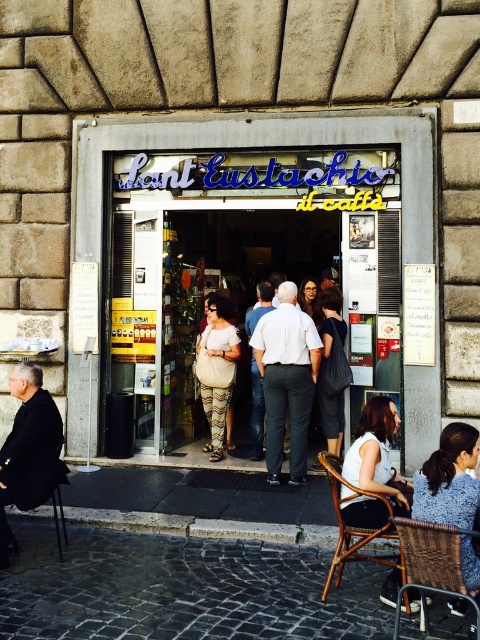
You are a customer waiting outside the entrance of Sant Eustachio il caff the image shows a white matte shirt at center and a bamboo chair at lower right. Which object is taller?

The white matte shirt at center is taller than the bamboo chair at lower right.

You are a customer waiting to enter the busy Sant Eustachio il caff? entrance. You see a white matte shirt at center and a woven brown chair at lower right. Which object is closer to the entrance?

The white matte shirt at center is closer to the entrance because the woven brown chair at lower right is behind it.

From the picture: You are a photographer standing outside the entrance of the Sant Eustachio il caff? to take a photo of the white matte shirt at center and the woven brown chair at lower right. Based on their sizes in the image, which object would appear bigger in the final photo?

The white matte shirt at center would appear bigger in the final photo since it has a larger size compared to the woven brown chair at lower right.